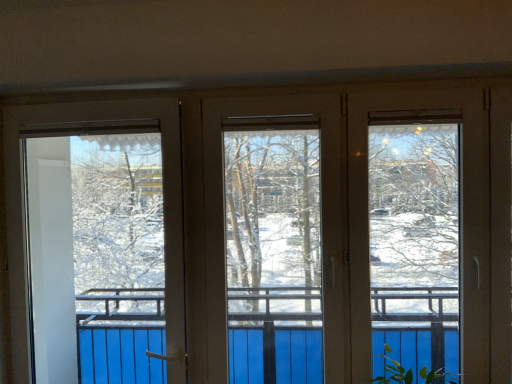
Question: From a real-world perspective, is transparent plastic screen door at left physically above green leafy plant at lower right?

Choices:
 (A) no
 (B) yes

Answer: (B)

Question: Is transparent plastic screen door at left looking in the opposite direction of green leafy plant at lower right?

Choices:
 (A) yes
 (B) no

Answer: (B)

Question: Is transparent plastic screen door at left positioned in front of green leafy plant at lower right?

Choices:
 (A) yes
 (B) no

Answer: (B)

Question: Considering the relative sizes of transparent plastic screen door at left and green leafy plant at lower right in the image provided, is transparent plastic screen door at left taller than green leafy plant at lower right?

Choices:
 (A) yes
 (B) no

Answer: (A)

Question: Is transparent plastic screen door at left further to camera compared to green leafy plant at lower right?

Choices:
 (A) yes
 (B) no

Answer: (A)

Question: Is transparent plastic screen door at left outside of green leafy plant at lower right?

Choices:
 (A) no
 (B) yes

Answer: (B)

Question: From the image's perspective, is green leafy plant at lower right on transparent plastic screen door at left?

Choices:
 (A) yes
 (B) no

Answer: (B)

Question: Can you confirm if green leafy plant at lower right is positioned to the right of transparent plastic screen door at left?

Choices:
 (A) yes
 (B) no

Answer: (A)

Question: Are green leafy plant at lower right and transparent plastic screen door at left located far from each other?

Choices:
 (A) yes
 (B) no

Answer: (A)

Question: From a real-world perspective, is green leafy plant at lower right located higher than transparent plastic screen door at left?

Choices:
 (A) yes
 (B) no

Answer: (B)

Question: Does green leafy plant at lower right turn towards transparent plastic screen door at left?

Choices:
 (A) no
 (B) yes

Answer: (A)

Question: Is green leafy plant at lower right outside of transparent plastic screen door at left?

Choices:
 (A) no
 (B) yes

Answer: (B)

Question: Does point pyautogui.click(x=380, y=380) appear closer or farther from the camera than point pyautogui.click(x=75, y=223)?

Choices:
 (A) farther
 (B) closer

Answer: (B)